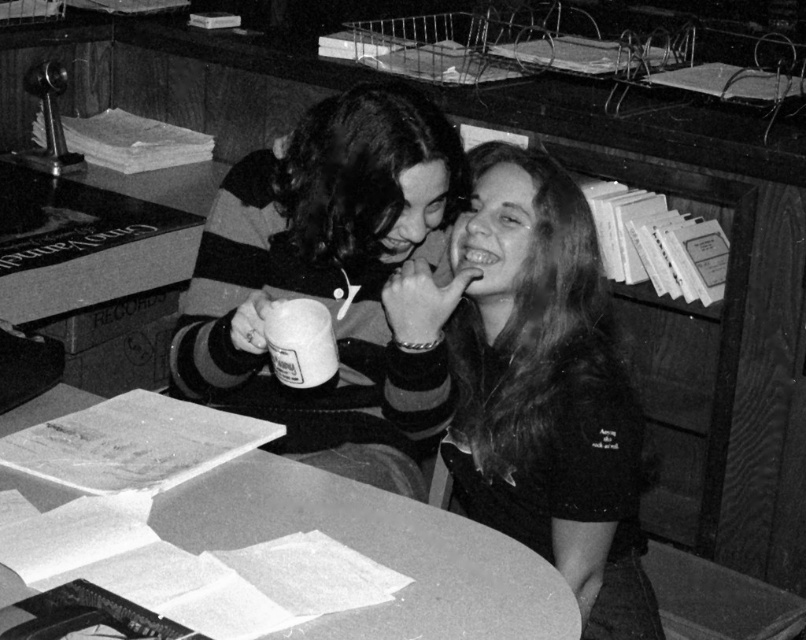
You are an observer looking at the scene. Which of the two individuals is wearing the smooth black shirt at center and is positioned higher than the striped sweater at center?

The smooth black shirt at center is higher than the striped sweater at center.

You are organizing a small event and need to decide whether to use the striped sweater at center or the smooth paper documents at center to wrap a gift. Which item would be more suitable for wrapping the gift based on their thickness?

The smooth paper documents at center are thicker than the striped sweater at center, making them more suitable for wrapping a gift as they provide better structural support and coverage.